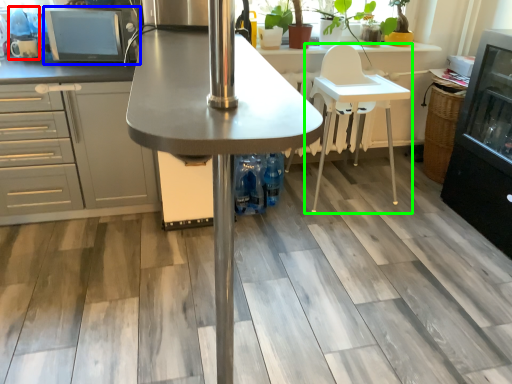
Question: Considering the real-world distances, which object is closest to appliance (highlighted by a red box)? appliance (highlighted by a blue box) or chair (highlighted by a green box).

Choices:
 (A) appliance
 (B) chair

Answer: (A)